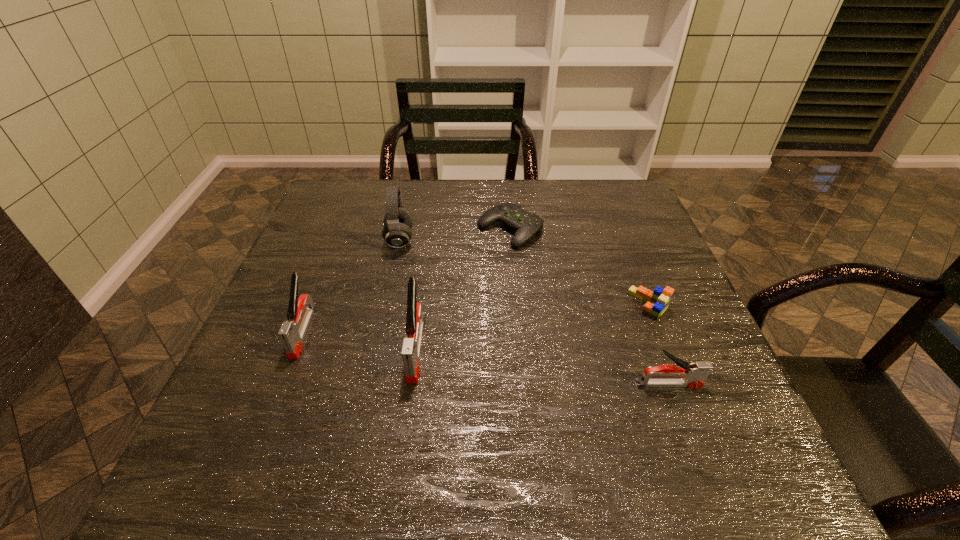
Locate an element on the screen. This screenshot has width=960, height=540. the leftmost stapler is located at coordinates (292, 332).

You are a GUI agent. You are given a task and a screenshot of the screen. Output one action in this format:
    pyautogui.click(x=<x>, y=<y>)
    Task: Click on the second shortest stapler
    
    Given the screenshot: What is the action you would take?
    pyautogui.click(x=292, y=332)

Where is `the third object from left to right`? the third object from left to right is located at coordinates coord(410,352).

Find the location of a particular element. The width and height of the screenshot is (960, 540). the shortest stapler is located at coordinates (694, 375).

You are a GUI agent. You are given a task and a screenshot of the screen. Output one action in this format:
    pyautogui.click(x=<x>, y=<y>)
    Task: Click on the rightmost stapler
    
    Given the screenshot: What is the action you would take?
    pyautogui.click(x=694, y=375)

Identify the location of headset. (398, 222).

The height and width of the screenshot is (540, 960). What are the coordinates of `the fifth tallest object` in the screenshot? It's located at (657, 301).

This screenshot has width=960, height=540. I want to click on control, so click(x=526, y=224).

Where is `the shortest object`? The image size is (960, 540). the shortest object is located at coordinates (526, 224).

You are a GUI agent. You are given a task and a screenshot of the screen. Output one action in this format:
    pyautogui.click(x=<x>, y=<y>)
    Task: Click on the vacant region located on the handle side of the leftmost stapler
    The image size is (960, 540).
    Given the screenshot: What is the action you would take?
    pyautogui.click(x=272, y=412)